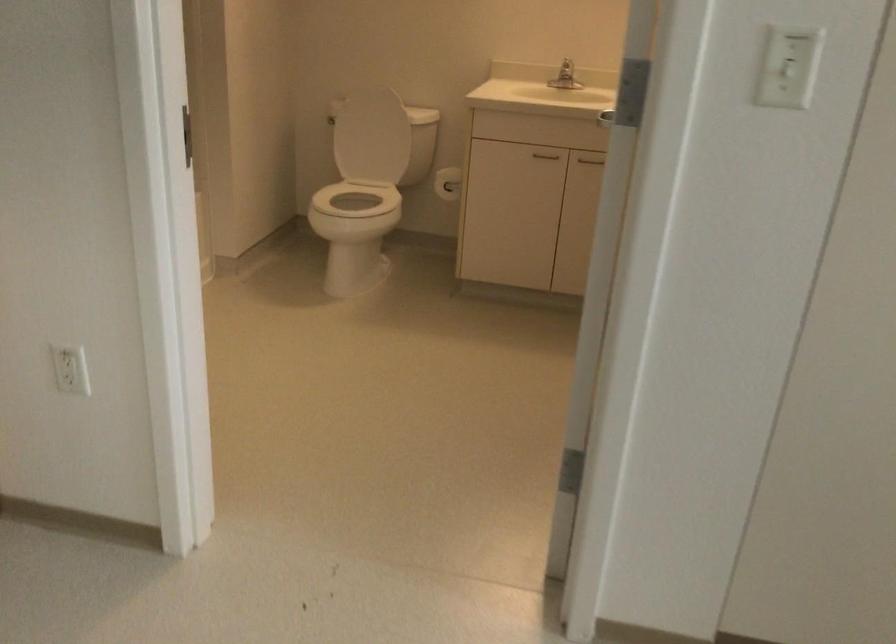
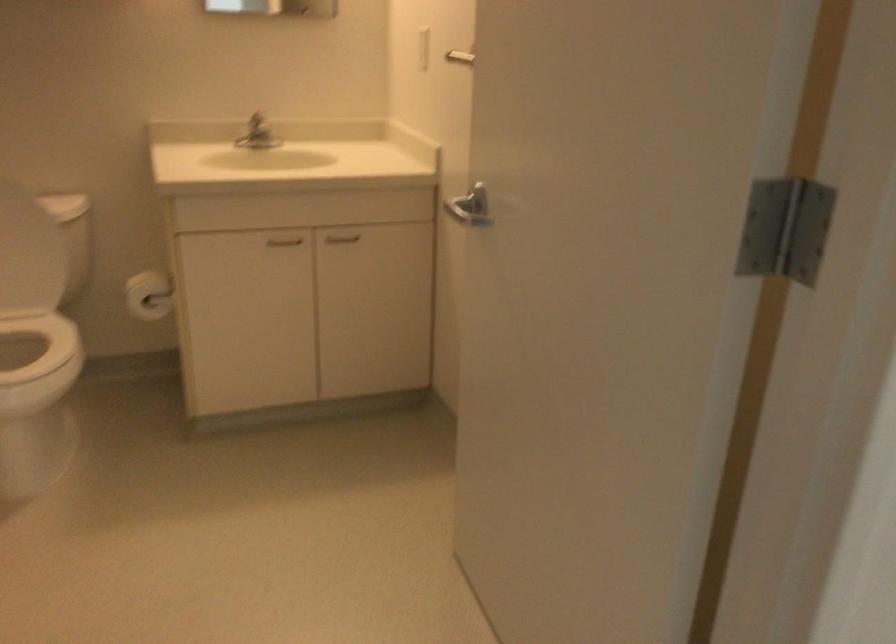
Locate, in the second image, the point that corresponds to the point at 373,203 in the first image.

(22, 341)